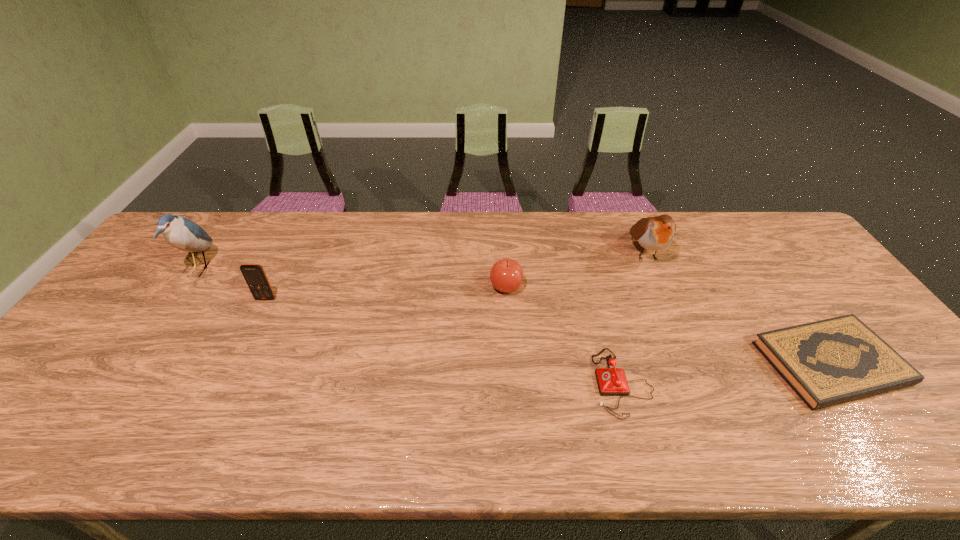
Where is `free space in the image that satisfies the following two spatial constraints: 1. on the front side of the shortest object; 2. on the dial of the telephone`? free space in the image that satisfies the following two spatial constraints: 1. on the front side of the shortest object; 2. on the dial of the telephone is located at coordinates (844, 383).

Image resolution: width=960 pixels, height=540 pixels. In order to click on blank space that satisfies the following two spatial constraints: 1. at the tip of the shortest object's beak; 2. on the right side of the leftmost object in this screenshot , I will do click(x=133, y=363).

Find the location of `free space that satisfies the following two spatial constraints: 1. on the screen of the rightmost object; 2. on the left side of the second object from left to right`. free space that satisfies the following two spatial constraints: 1. on the screen of the rightmost object; 2. on the left side of the second object from left to right is located at coordinates (233, 363).

The image size is (960, 540). Find the location of `free space that satisfies the following two spatial constraints: 1. at the face of the shorter bird; 2. on the left side of the rightmost object`. free space that satisfies the following two spatial constraints: 1. at the face of the shorter bird; 2. on the left side of the rightmost object is located at coordinates point(692,363).

Locate an element on the screen. vacant region that satisfies the following two spatial constraints: 1. at the face of the second object from right to left; 2. on the left side of the shortest object is located at coordinates (692, 363).

The height and width of the screenshot is (540, 960). I want to click on vacant point that satisfies the following two spatial constraints: 1. at the tip of the shortest object's beak; 2. on the right side of the leftmost object, so pyautogui.click(x=133, y=363).